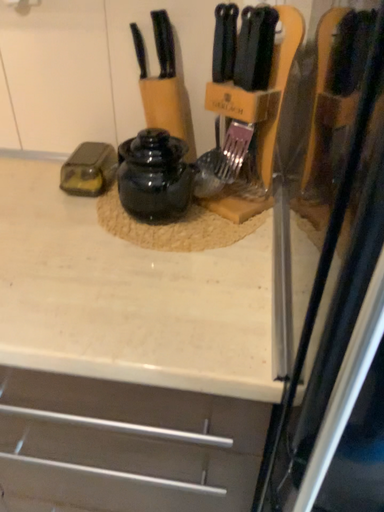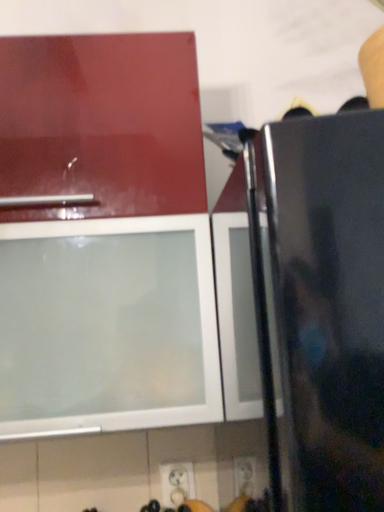
Question: How did the camera likely rotate when shooting the video?

Choices:
 (A) rotated right
 (B) rotated left

Answer: (A)